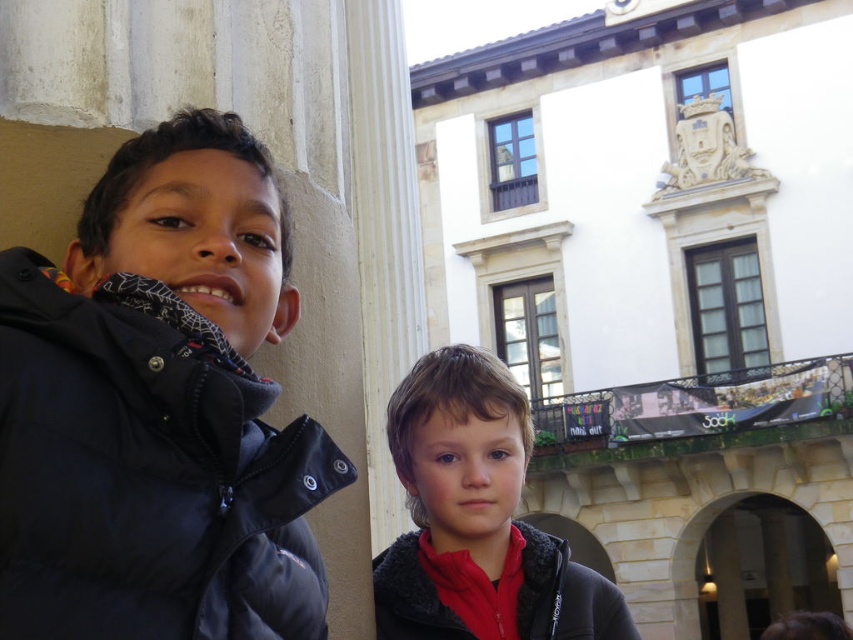
You are a photographer trying to decide where to place a new camera tripod in the scene. The tripod needs to be positioned between the matte black jacket at left and the red fleece jacket at lower right. Considering their sizes, which jacket should you place the tripod closer to and why?

The matte black jacket at left is smaller than the red fleece jacket at lower right, so the tripod should be placed closer to the red fleece jacket at lower right to ensure stability and balance between the two objects.

Where is the matte black jacket at left located in the image?

The matte black jacket at left is located at point (148, 472).

You are a photographer setting up a photo shoot in front of a historic building. You have two jackets to place on a stand. The matte black jacket at left and the red fleece jacket at center. Based on the scene, which jacket should you place higher on the stand to match their sizes in the image?

The red fleece jacket at center should be placed higher on the stand since it has a greater height compared to the matte black jacket at left according to the description.